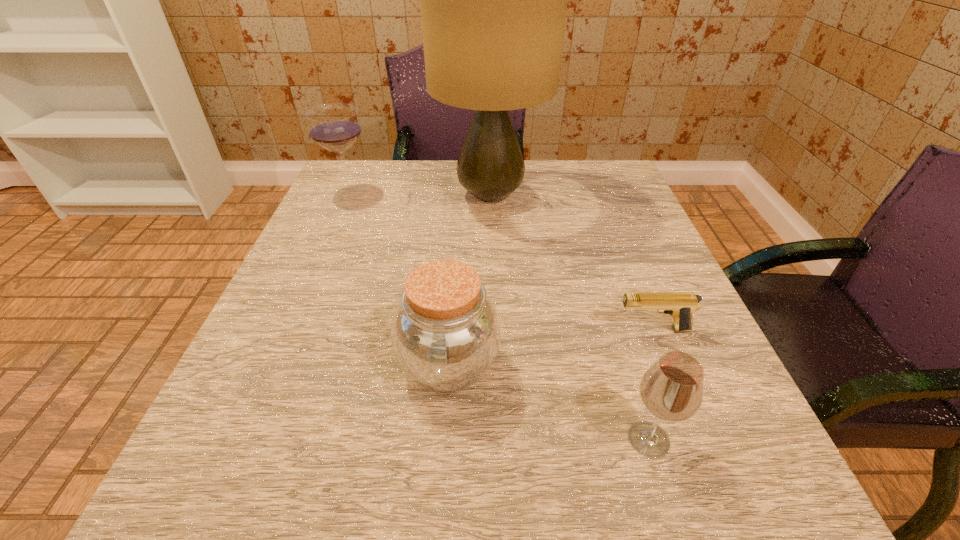
Locate an element on the screen. free space between the nearer wineglass and the tallest object is located at coordinates (569, 317).

The image size is (960, 540). Find the location of `vacant space in between the jar and the leftmost object`. vacant space in between the jar and the leftmost object is located at coordinates (398, 279).

At what (x,y) coordinates should I click in order to perform the action: click on vacant space in between the jar and the shortest object. Please return your answer as a coordinate pair (x, y). The width and height of the screenshot is (960, 540). Looking at the image, I should click on (551, 347).

Find the location of `free space between the shorter wineglass and the jar`. free space between the shorter wineglass and the jar is located at coordinates (549, 402).

Identify the location of unoccupied position between the jar and the taller wineglass. Image resolution: width=960 pixels, height=540 pixels. (398, 279).

Where is `vacant area that lies between the shorter wineglass and the jar`? vacant area that lies between the shorter wineglass and the jar is located at coordinates (549, 402).

Where is `free spot between the taller wineglass and the jar`? This screenshot has height=540, width=960. free spot between the taller wineglass and the jar is located at coordinates (398, 279).

Locate which object ranks fourth in proximity to the pistol. Please provide its 2D coordinates. Your answer should be formatted as a tuple, i.e. [(x, y)], where the tuple contains the x and y coordinates of a point satisfying the conditions above.

[(335, 127)]

The height and width of the screenshot is (540, 960). I want to click on object that is the third nearest to the nearest object, so click(x=493, y=0).